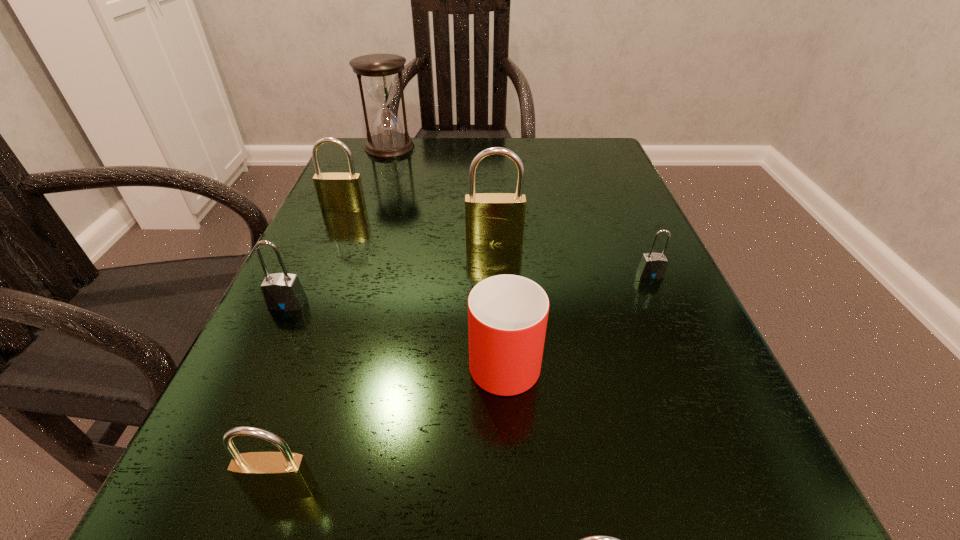
At what (x,y) coordinates should I click in order to perform the action: click on the farthest object. Please return your answer as a coordinate pair (x, y). Looking at the image, I should click on (379, 71).

I want to click on the biggest brass padlock, so click(x=491, y=218).

You are a GUI agent. You are given a task and a screenshot of the screen. Output one action in this format:
    pyautogui.click(x=<x>, y=<y>)
    Task: Click on the sixth nearest object
    
    Given the screenshot: What is the action you would take?
    pyautogui.click(x=491, y=218)

In order to click on the second farthest object in this screenshot , I will do `click(337, 192)`.

The image size is (960, 540). I want to click on the fifth shortest padlock, so click(x=337, y=192).

Locate an element on the screen. This screenshot has height=540, width=960. red cup is located at coordinates (507, 314).

What are the coordinates of `the third nearest object` in the screenshot? It's located at (507, 314).

This screenshot has height=540, width=960. I want to click on the fourth nearest object, so click(x=281, y=291).

Locate an element on the screen. the nearer gray padlock is located at coordinates (281, 291).

Image resolution: width=960 pixels, height=540 pixels. I want to click on the seventh farthest object, so click(283, 475).